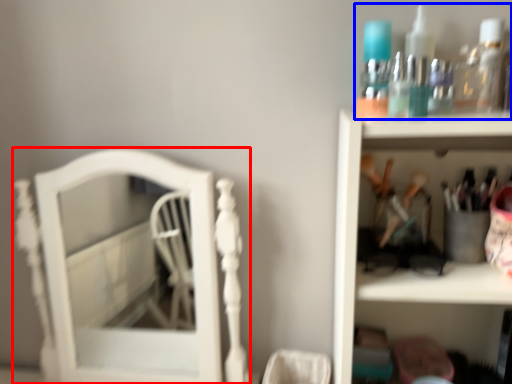
Question: Among these objects, which one is farthest to the camera, furniture (highlighted by a red box) or collection (highlighted by a blue box)?

Choices:
 (A) furniture
 (B) collection

Answer: (A)